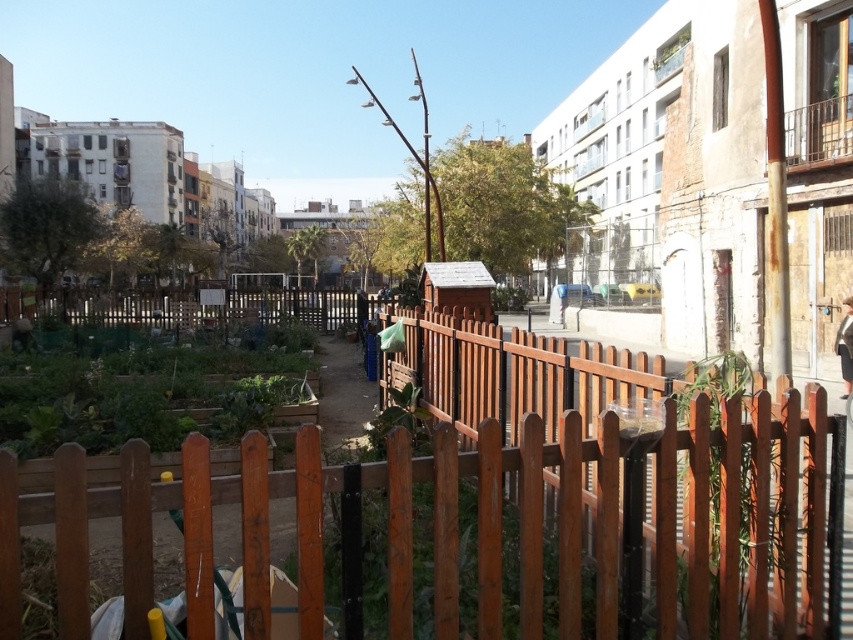
You are a gardener standing at the entrance of the urban garden. You need to reach the green matte vegetable garden at lower left but there is a brown wooden fence at center in your way. Can you walk around the fence to access the garden?

The brown wooden fence at center is above the green matte vegetable garden at lower left, meaning the fence is positioned higher up relative to the garden. Since the garden is at a lower position, you can walk around the fence by moving to the side or behind it to access the garden.

You are standing in the urban garden and want to reach a specific point marked at coordinates point (831,452). If your maximum comfortable walking distance is 2.5 meters, can you comfortably reach that point without straining?

The distance of point (831,452) from viewer is 2.78 meters, which exceeds your maximum comfortable walking distance of 2.5 meters. Therefore, reaching that point may require some effort or adjustment.

From the picture: You are a gardener who wants to water the green matte vegetable garden at lower left. You are currently standing behind the brown wooden fence at center. Can you directly access the garden without moving past the fence?

The brown wooden fence at center is in front of the green matte vegetable garden at lower left, so you cannot directly access the garden without moving past the fence.